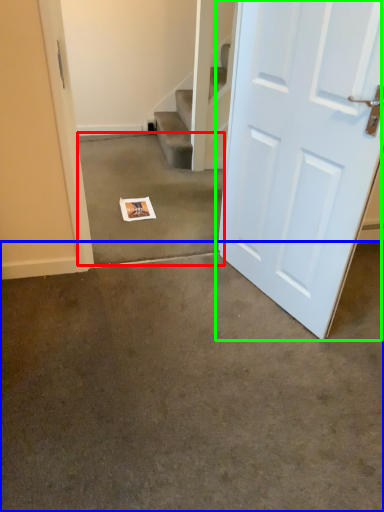
Question: Estimate the real-world distances between objects in this image. Which object is farther from concrete (highlighted by a red box), concrete (highlighted by a blue box) or door (highlighted by a green box)?

Choices:
 (A) concrete
 (B) door

Answer: (A)